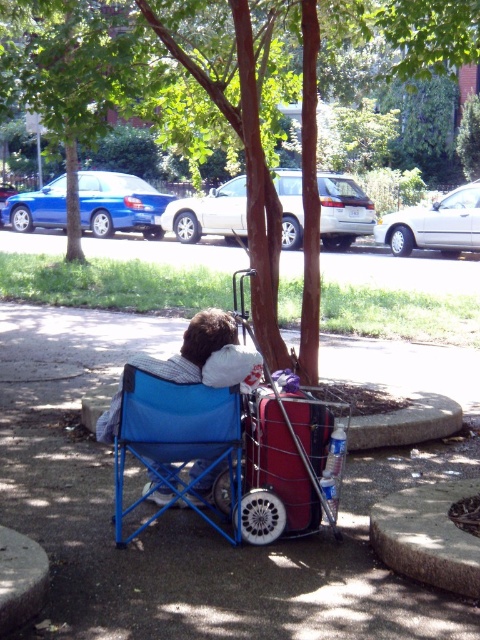
Is green leafy tree at center below blue fabric chair at center?

No.

In the scene shown: Does green leafy tree at center have a larger size compared to blue fabric chair at center?

Yes, green leafy tree at center is bigger than blue fabric chair at center.

Image resolution: width=480 pixels, height=640 pixels. What do you see at coordinates (165, 88) in the screenshot?
I see `green leafy tree at center` at bounding box center [165, 88].

I want to click on green leafy tree at center, so click(x=165, y=88).